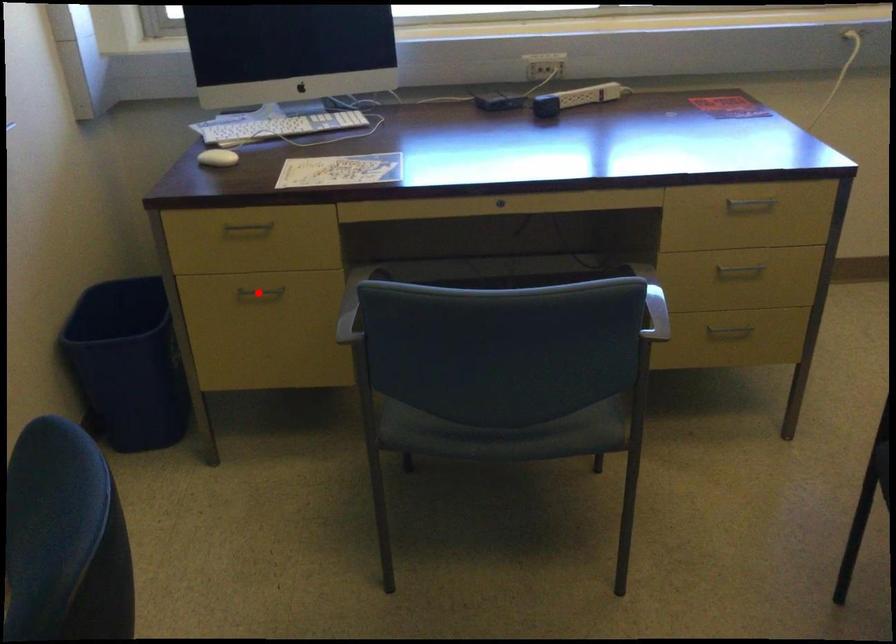
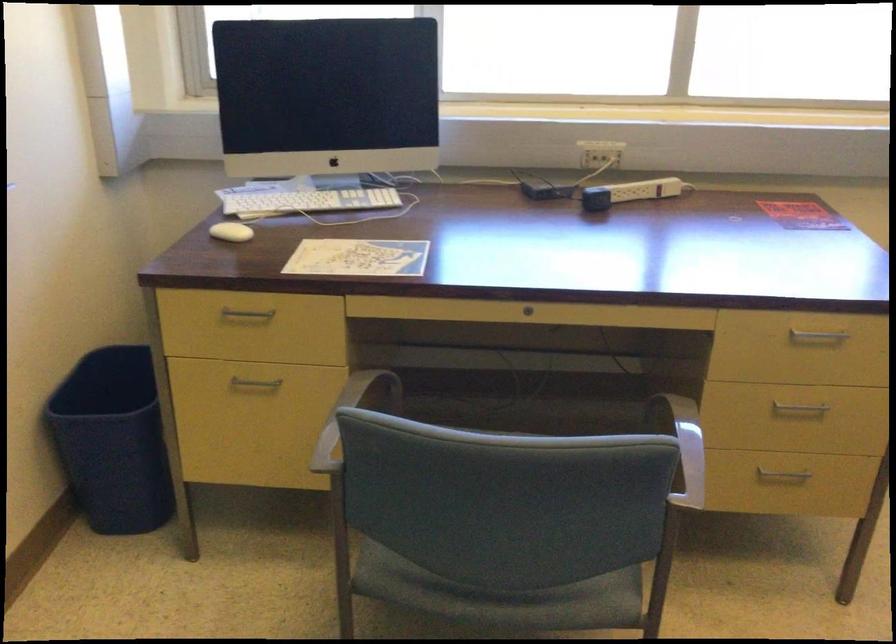
Question: I am providing you with two images of the same scene from different viewpoints. Given a red point in image1, look at the same physical point in image2. Is it:

Choices:
 (A) Closer to the viewpoint
 (B) Farther from the viewpoint

Answer: (A)